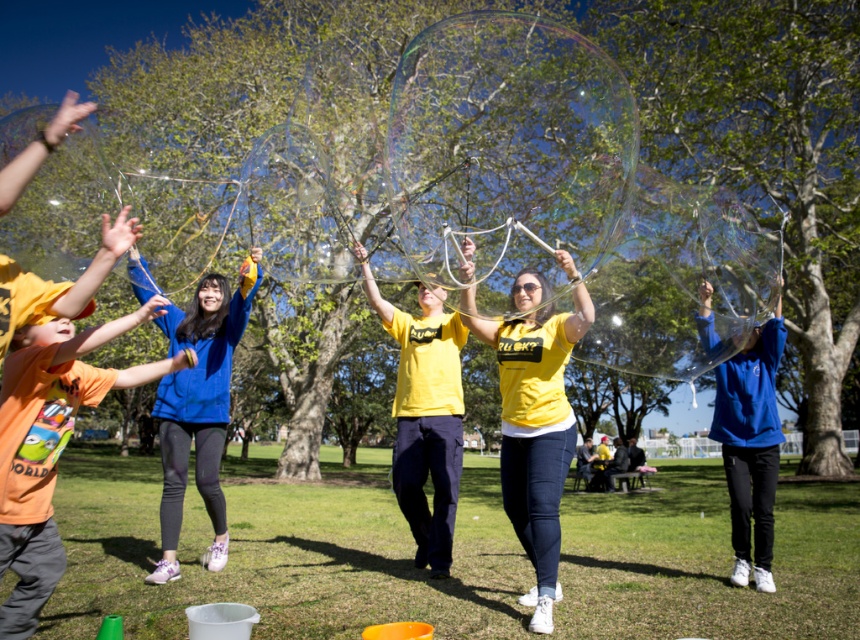
Consider the image. You are a photographer trying to capture a photo of the yellow matte shirt at center and the blue fleece jacket at center. Based on their positions, which one should you focus on first to ensure both are in the frame?

The yellow matte shirt at center is located above the blue fleece jacket at center, so you should focus on the blue fleece jacket at center first to ensure both are in the frame.